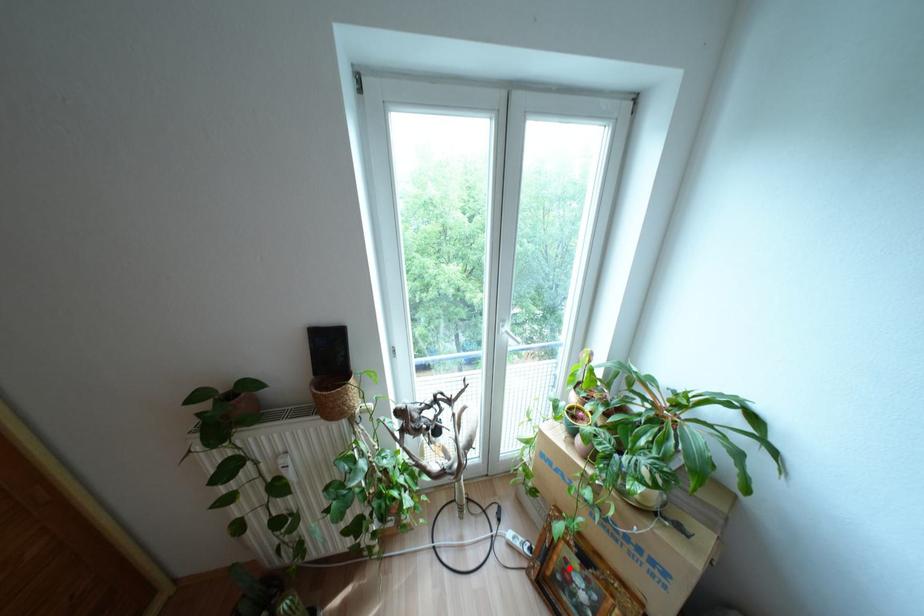
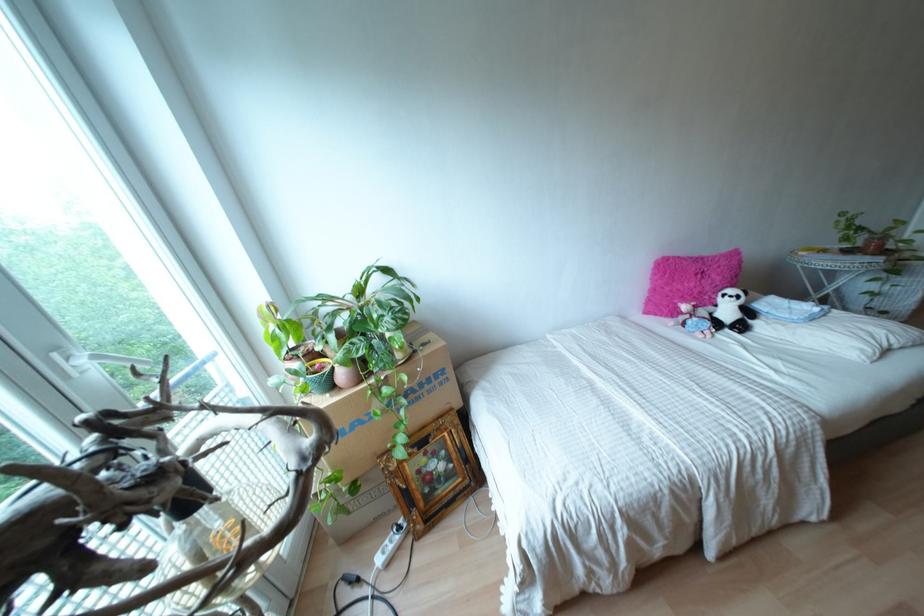
Question: I am providing you with two images of the same scene from different viewpoints. In image1, a red point is highlighted. Considering the same 3D point in image2, which of the following is correct?

Choices:
 (A) It is closer
 (B) It is farther

Answer: (B)